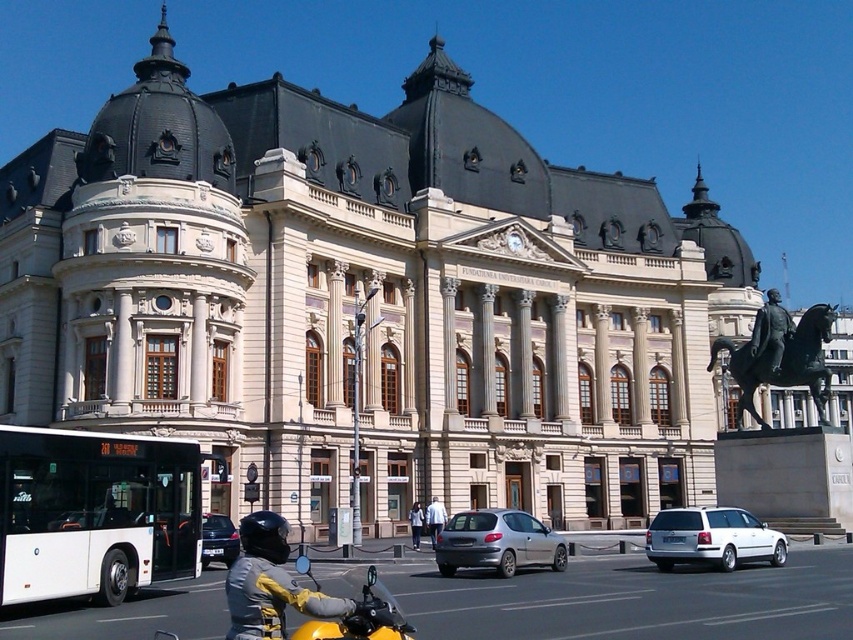
Can you confirm if yellow matte motorcycle at lower center is positioned to the right of silver metallic sedan at center?

Indeed, yellow matte motorcycle at lower center is positioned on the right side of silver metallic sedan at center.

What do you see at coordinates (363, 618) in the screenshot?
I see `yellow matte motorcycle at lower center` at bounding box center [363, 618].

Locate an element on the screen. The width and height of the screenshot is (853, 640). yellow matte motorcycle at lower center is located at coordinates (363, 618).

Describe the element at coordinates (270, 582) in the screenshot. I see `yellow matte jacket at lower center` at that location.

Which is more to the right, yellow matte jacket at lower center or light blue fabric jacket at center?

Positioned to the right is light blue fabric jacket at center.

Is point (286, 592) in front of point (415, 548)?

That is True.

This screenshot has height=640, width=853. I want to click on yellow matte jacket at lower center, so click(270, 582).

Is point (357, 618) in front of point (434, 509)?

Yes, point (357, 618) is in front of point (434, 509).

Does yellow matte motorcycle at lower center have a larger size compared to white fabric jacket at lower center?

Indeed, yellow matte motorcycle at lower center has a larger size compared to white fabric jacket at lower center.

Is point (390, 625) in front of point (442, 512)?

Yes.

Where is `yellow matte motorcycle at lower center`? This screenshot has height=640, width=853. yellow matte motorcycle at lower center is located at coordinates (363, 618).